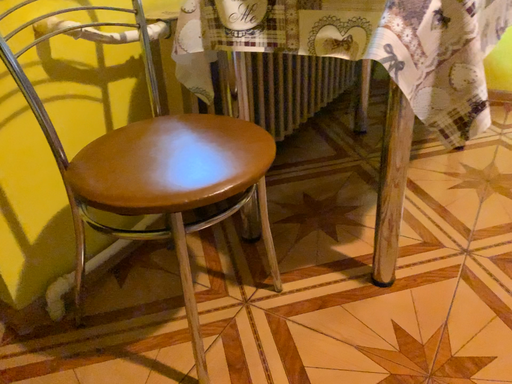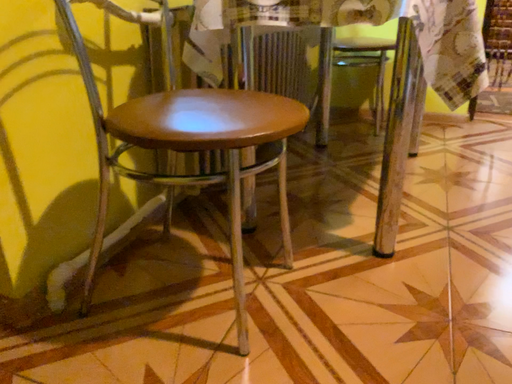
Question: How did the camera likely rotate when shooting the video?

Choices:
 (A) rotated left
 (B) rotated right

Answer: (B)